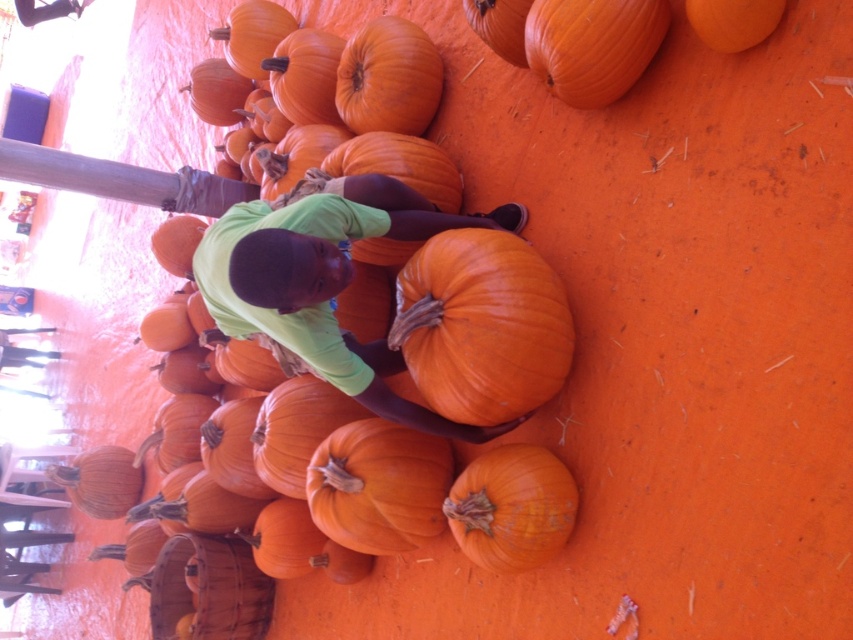
Is orange matte pumpkin at center to the left of smooth orange pumpkin at lower left from the viewer's perspective?

Incorrect, orange matte pumpkin at center is not on the left side of smooth orange pumpkin at lower left.

In the scene shown: Does orange matte pumpkin at center appear on the right side of smooth orange pumpkin at lower left?

Correct, you'll find orange matte pumpkin at center to the right of smooth orange pumpkin at lower left.

Looking at this image, who is more forward, (474, 374) or (55, 476)?

Point (474, 374)

Locate an element on the screen. orange matte pumpkin at center is located at coordinates (480, 324).

Does smooth orange pumpkin at center have a greater width compared to smooth orange pumpkin at lower left?

Incorrect, smooth orange pumpkin at center's width does not surpass smooth orange pumpkin at lower left's.

Find the location of a particular element. This screenshot has height=640, width=853. smooth orange pumpkin at center is located at coordinates (387, 77).

Is point (370, 40) less distant than point (114, 516)?

Yes, point (370, 40) is in front of point (114, 516).

Image resolution: width=853 pixels, height=640 pixels. Find the location of `smooth orange pumpkin at center`. smooth orange pumpkin at center is located at coordinates (387, 77).

Is green matte shirt at center behind smooth orange pumpkin at lower left?

No.

Is point (519, 211) in front of point (80, 492)?

Yes, point (519, 211) is closer to viewer.

This screenshot has width=853, height=640. What are the coordinates of `green matte shirt at center` in the screenshot? It's located at (325, 282).